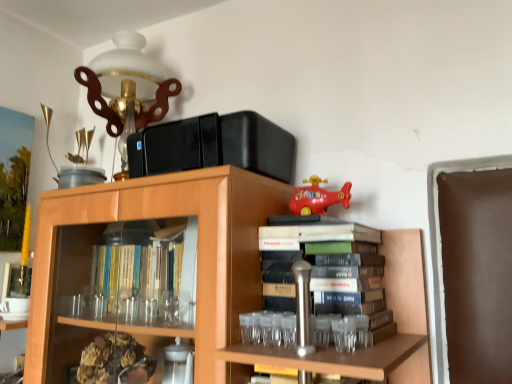
This screenshot has width=512, height=384. What are the coordinates of `wooden bookcase at upper center` in the screenshot? It's located at (203, 273).

Describe the element at coordinates (203, 273) in the screenshot. I see `wooden bookcase at upper center` at that location.

This screenshot has width=512, height=384. What do you see at coordinates (127, 88) in the screenshot? I see `matte white glass table lamp at upper left` at bounding box center [127, 88].

At what (x,y) coordinates should I click in order to perform the action: click on matte plastic toy helicopter at upper right. Please return your answer as a coordinate pair (x, y). Looking at the image, I should click on 318,197.

Find the location of a particular element. This screenshot has width=512, height=384. wooden bookcase at upper center is located at coordinates (203, 273).

Is matte white glass table lamp at upper left taller or shorter than wooden bookcase at upper center?

Considering their sizes, matte white glass table lamp at upper left has less height than wooden bookcase at upper center.

Is matte white glass table lamp at upper left next to wooden bookcase at upper center?

matte white glass table lamp at upper left is not next to wooden bookcase at upper center, and they're not touching.

Looking at this image, can you confirm if matte white glass table lamp at upper left is positioned to the left of wooden bookcase at upper center?

Yes.

Is matte white glass table lamp at upper left thinner than wooden bookcase at upper center?

Yes.

Does matte plastic toy helicopter at upper right appear on the right side of matte white glass table lamp at upper left?

Yes.

Is matte white glass table lamp at upper left completely or partially inside matte plastic toy helicopter at upper right?

No, matte white glass table lamp at upper left is not surrounded by matte plastic toy helicopter at upper right.

Is matte white glass table lamp at upper left at the back of matte plastic toy helicopter at upper right?

No, matte plastic toy helicopter at upper right is not facing the opposite direction of matte white glass table lamp at upper left.

Is matte plastic toy helicopter at upper right positioned behind matte white glass table lamp at upper left?

No, matte plastic toy helicopter at upper right is in front of matte white glass table lamp at upper left.

Who is shorter, wooden bookcase at upper center or matte white glass table lamp at upper left?

With less height is matte white glass table lamp at upper left.

Is wooden bookcase at upper center surrounding matte white glass table lamp at upper left?

No.

Is point (44, 200) positioned after point (118, 114)?

No, it is not.

From a real-world perspective, is wooden bookcase at upper center above or below matte white glass table lamp at upper left?

wooden bookcase at upper center is below matte white glass table lamp at upper left.

Consider the image. Would you say matte white glass table lamp at upper left is to the left or to the right of matte plastic toy helicopter at upper right in the picture?

From the image, it's evident that matte white glass table lamp at upper left is to the left of matte plastic toy helicopter at upper right.

Looking at their sizes, would you say matte white glass table lamp at upper left is wider or thinner than matte plastic toy helicopter at upper right?

Clearly, matte white glass table lamp at upper left has more width compared to matte plastic toy helicopter at upper right.

In the scene shown: How much distance is there between matte white glass table lamp at upper left and matte plastic toy helicopter at upper right?

matte white glass table lamp at upper left and matte plastic toy helicopter at upper right are 29.28 inches apart.

Find the location of `table lamp that appears above the matte plastic toy helicopter at upper right (from the image's perspective)`. table lamp that appears above the matte plastic toy helicopter at upper right (from the image's perspective) is located at coordinates (127, 88).

Is there a large distance between matte plastic toy helicopter at upper right and wooden bookcase at upper center?

No, matte plastic toy helicopter at upper right is not far from wooden bookcase at upper center.

Considering the positions of objects matte plastic toy helicopter at upper right and wooden bookcase at upper center in the image provided, who is behind, matte plastic toy helicopter at upper right or wooden bookcase at upper center?

matte plastic toy helicopter at upper right is further away from the camera.

In terms of size, does matte plastic toy helicopter at upper right appear bigger or smaller than wooden bookcase at upper center?

Considering their sizes, matte plastic toy helicopter at upper right takes up less space than wooden bookcase at upper center.

From a real-world perspective, between wooden bookcase at upper center and matte plastic toy helicopter at upper right, who is vertically higher?

From a 3D spatial view, matte plastic toy helicopter at upper right is above.

Locate an element on the screen. bookcase on the left side of matte plastic toy helicopter at upper right is located at coordinates (203, 273).

In the image, is wooden bookcase at upper center on the left side or the right side of matte plastic toy helicopter at upper right?

wooden bookcase at upper center is to the left of matte plastic toy helicopter at upper right.

Can you see wooden bookcase at upper center touching matte plastic toy helicopter at upper right?

No, wooden bookcase at upper center is not touching matte plastic toy helicopter at upper right.

This screenshot has height=384, width=512. What are the coordinates of `bookcase in front of the matte white glass table lamp at upper left` in the screenshot? It's located at (203, 273).

The height and width of the screenshot is (384, 512). In order to click on toy on the right of matte white glass table lamp at upper left in this screenshot , I will do `click(318, 197)`.

Which object lies nearer to the anchor point wooden bookcase at upper center, matte plastic toy helicopter at upper right or matte white glass table lamp at upper left?

matte plastic toy helicopter at upper right lies closer to wooden bookcase at upper center than the other object.

From the image, which object appears to be nearer to matte plastic toy helicopter at upper right, wooden bookcase at upper center or matte white glass table lamp at upper left?

wooden bookcase at upper center is positioned closer to the anchor matte plastic toy helicopter at upper right.

Consider the image. Which object lies further to the anchor point matte plastic toy helicopter at upper right, matte white glass table lamp at upper left or wooden bookcase at upper center?

Among the two, matte white glass table lamp at upper left is located further to matte plastic toy helicopter at upper right.

Considering their positions, is matte white glass table lamp at upper left positioned further to wooden bookcase at upper center than matte plastic toy helicopter at upper right?

Among the two, matte white glass table lamp at upper left is located further to wooden bookcase at upper center.

Estimate the real-world distances between objects in this image. Which object is further from matte white glass table lamp at upper left, wooden bookcase at upper center or matte plastic toy helicopter at upper right?

matte plastic toy helicopter at upper right lies further to matte white glass table lamp at upper left than the other object.

When comparing their distances from matte white glass table lamp at upper left, does matte plastic toy helicopter at upper right or wooden bookcase at upper center seem closer?

wooden bookcase at upper center is closer to matte white glass table lamp at upper left.

Find the location of a particular element. This screenshot has height=384, width=512. bookcase between matte white glass table lamp at upper left and matte plastic toy helicopter at upper right in the horizontal direction is located at coordinates (203, 273).